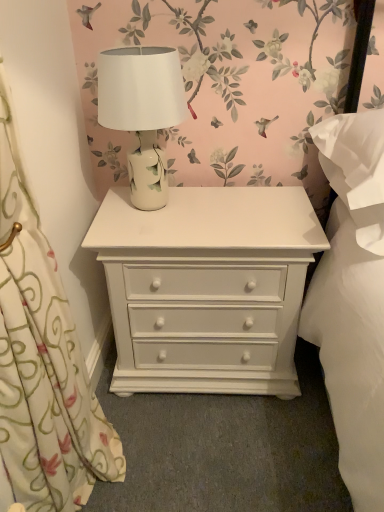
Question: From the image's perspective, is white painted wood chest of drawers at center over white ceramic table lamp at center?

Choices:
 (A) yes
 (B) no

Answer: (B)

Question: Can you confirm if white painted wood chest of drawers at center is smaller than white ceramic table lamp at center?

Choices:
 (A) no
 (B) yes

Answer: (A)

Question: Is white painted wood chest of drawers at center in front of white ceramic table lamp at center?

Choices:
 (A) yes
 (B) no

Answer: (B)

Question: From a real-world perspective, is white painted wood chest of drawers at center below white ceramic table lamp at center?

Choices:
 (A) no
 (B) yes

Answer: (B)

Question: Is the depth of white painted wood chest of drawers at center greater than that of white ceramic table lamp at center?

Choices:
 (A) yes
 (B) no

Answer: (A)

Question: Considering the positions of white painted wood chest of drawers at center and white floral fabric at left in the image, is white painted wood chest of drawers at center bigger or smaller than white floral fabric at left?

Choices:
 (A) small
 (B) big

Answer: (B)

Question: Is white painted wood chest of drawers at center taller or shorter than white floral fabric at left?

Choices:
 (A) tall
 (B) short

Answer: (B)

Question: Does point (312, 248) appear closer or farther from the camera than point (69, 394)?

Choices:
 (A) closer
 (B) farther

Answer: (B)

Question: From a real-world perspective, is white painted wood chest of drawers at center positioned above or below white floral fabric at left?

Choices:
 (A) below
 (B) above

Answer: (A)

Question: From the image's perspective, is white floral fabric at left positioned above or below white painted wood chest of drawers at center?

Choices:
 (A) below
 (B) above

Answer: (A)

Question: In terms of size, does white floral fabric at left appear bigger or smaller than white painted wood chest of drawers at center?

Choices:
 (A) small
 (B) big

Answer: (A)

Question: Considering the positions of point (16, 465) and point (243, 278), is point (16, 465) closer or farther from the camera than point (243, 278)?

Choices:
 (A) closer
 (B) farther

Answer: (A)

Question: In the image, is white floral fabric at left positioned in front of or behind white painted wood chest of drawers at center?

Choices:
 (A) behind
 (B) front

Answer: (B)

Question: Considering the positions of white painted wood chest of drawers at center and white ceramic table lamp at center in the image, is white painted wood chest of drawers at center taller or shorter than white ceramic table lamp at center?

Choices:
 (A) tall
 (B) short

Answer: (A)

Question: Is white painted wood chest of drawers at center in front of or behind white ceramic table lamp at center in the image?

Choices:
 (A) behind
 (B) front

Answer: (A)